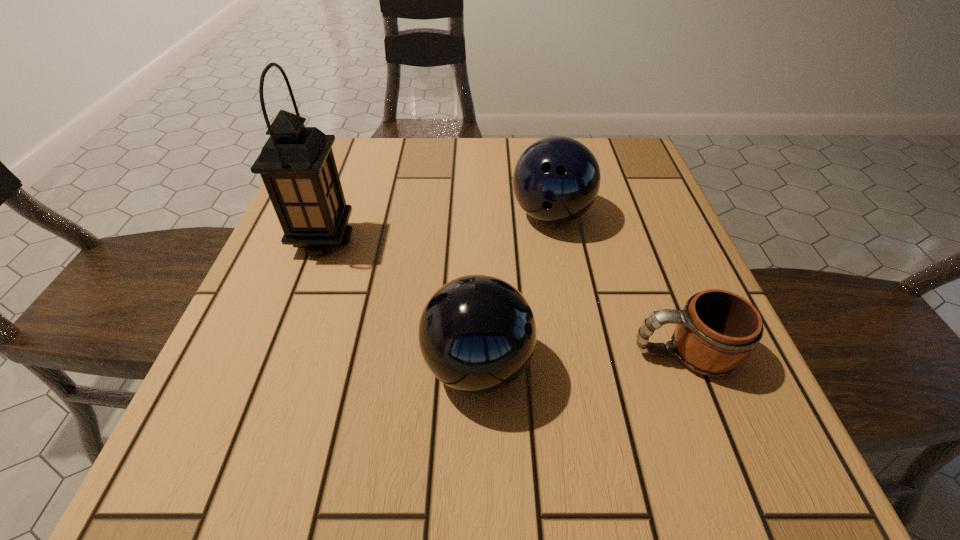
Where is `vacant space positioned 0.190m on the side of the shortest object with the handle`? The height and width of the screenshot is (540, 960). vacant space positioned 0.190m on the side of the shortest object with the handle is located at coordinates (507, 353).

Locate an element on the screen. The height and width of the screenshot is (540, 960). vacant position located on the side of the shortest object with the handle is located at coordinates (468, 353).

The height and width of the screenshot is (540, 960). Identify the location of object at the far edge. (556, 180).

In order to click on object that is at the left edge in this screenshot , I will do `click(297, 165)`.

Where is `bowling ball positioned at the right edge`? bowling ball positioned at the right edge is located at coordinates (556, 180).

The height and width of the screenshot is (540, 960). Identify the location of mug positioned at the right edge. (717, 330).

Locate an element on the screen. object located in the far right corner section of the desktop is located at coordinates point(556,180).

In the image, there is a desktop. Where is `free space at the far edge`? free space at the far edge is located at coordinates (485, 183).

Where is `vacant space at the near edge`? The width and height of the screenshot is (960, 540). vacant space at the near edge is located at coordinates (617, 476).

Identify the location of blank space at the left edge. The width and height of the screenshot is (960, 540). (364, 201).